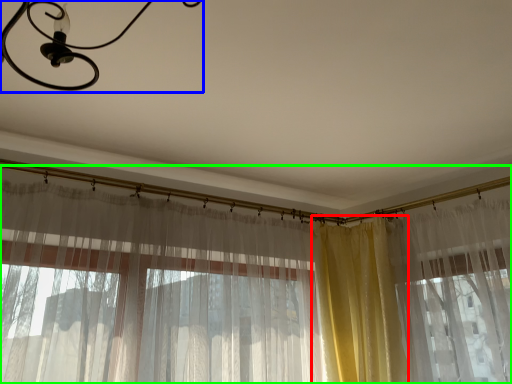
Question: Estimate the real-world distances between objects in this image. Which object is farther from curtain (highlighted by a red box), light fixture (highlighted by a blue box) or curtain (highlighted by a green box)?

Choices:
 (A) light fixture
 (B) curtain

Answer: (A)